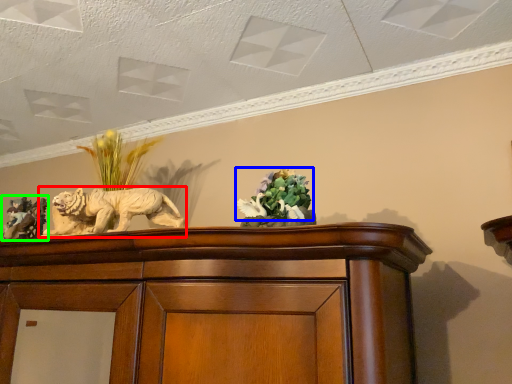
Question: Which object is positioned farthest from lion (highlighted by a red box)? Select from flower (highlighted by a blue box) and sculpture (highlighted by a green box).

Choices:
 (A) flower
 (B) sculpture

Answer: (A)